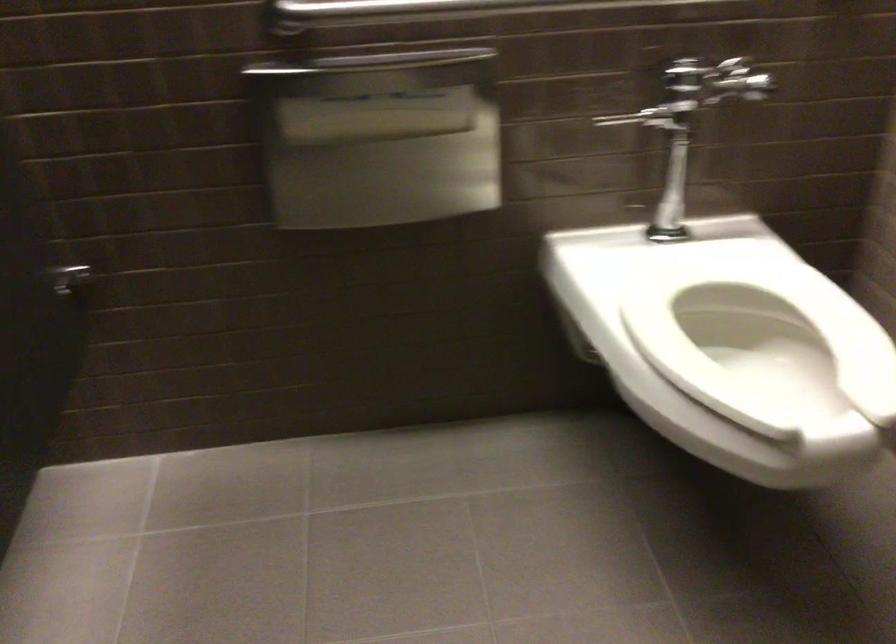
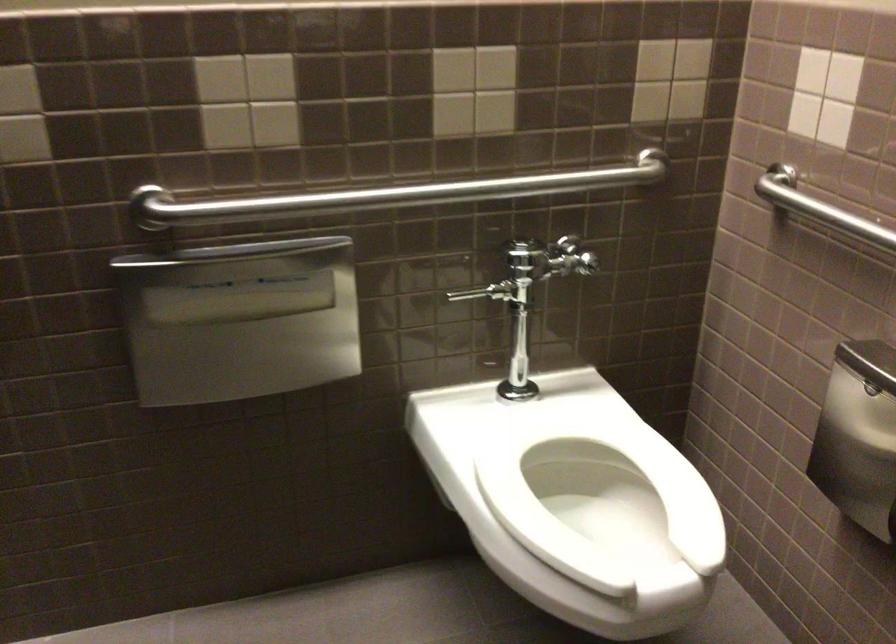
Question: Which direction would the cameraman need to move to produce the second image? Reply with the corresponding letter.

Choices:
 (A) Left
 (B) Right
 (C) Forward
 (D) Backward

Answer: (D)